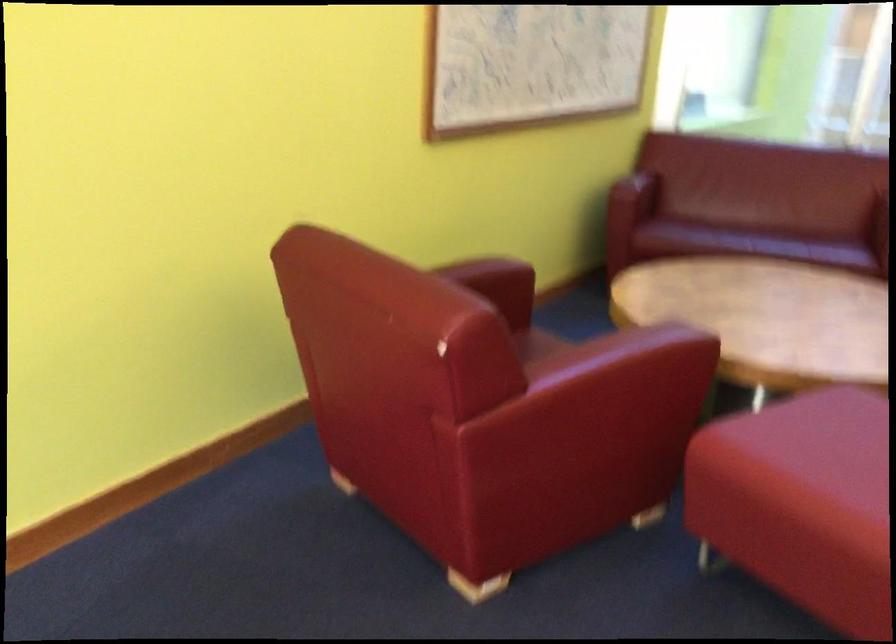
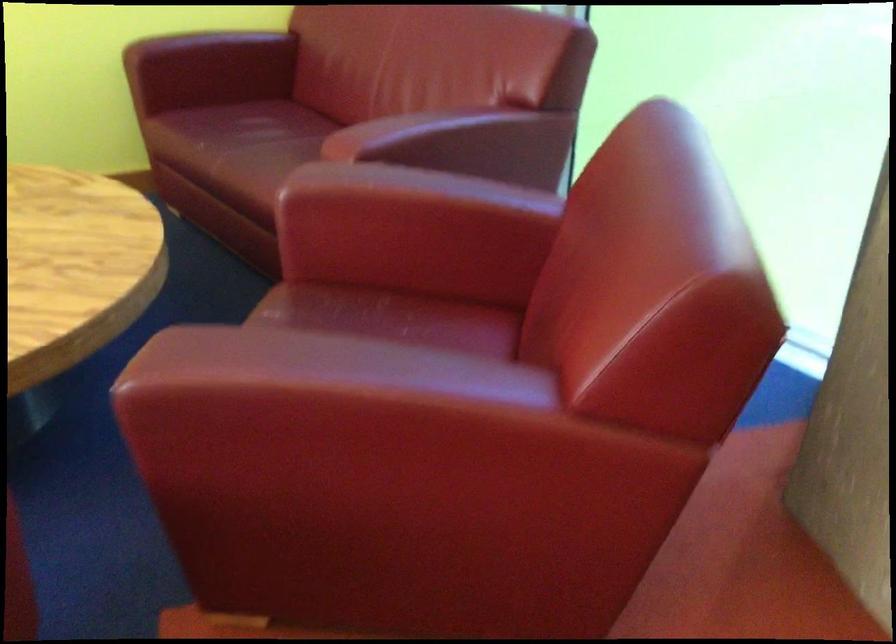
Locate, in the second image, the point that corresponds to the point at 642,191 in the first image.

(208, 69)